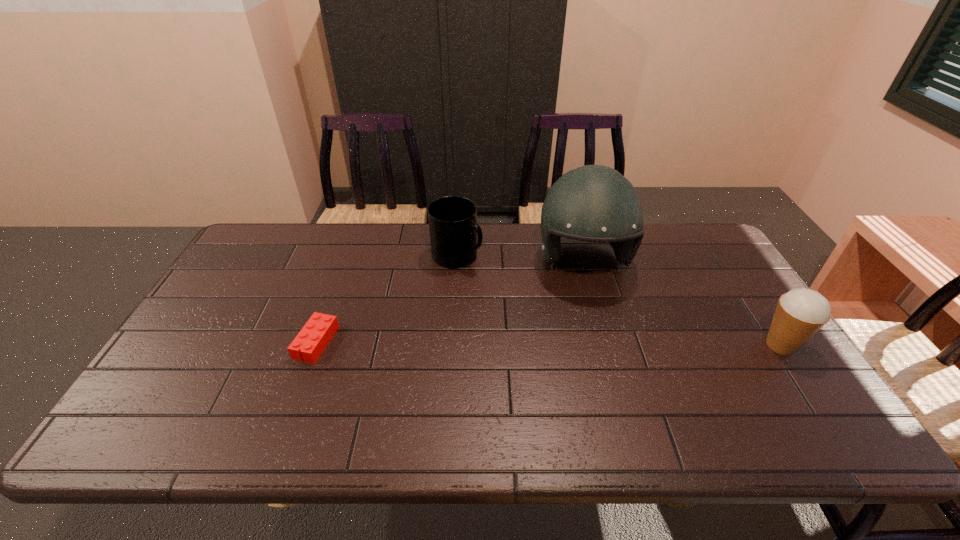
The height and width of the screenshot is (540, 960). Identify the location of free location located 0.300m at the face opening of the second object from right to left. (612, 380).

The width and height of the screenshot is (960, 540). Find the location of `vacant region located 0.380m on the side of the second object from left to right with the handle`. vacant region located 0.380m on the side of the second object from left to right with the handle is located at coordinates (575, 329).

Where is `vacant space located on the side of the second object from left to right with the handle`? The width and height of the screenshot is (960, 540). vacant space located on the side of the second object from left to right with the handle is located at coordinates (565, 323).

Identify the location of free space located on the side of the second object from left to right with the handle. (509, 288).

At what (x,y) coordinates should I click in order to perform the action: click on football helmet that is at the far edge. Please return your answer as a coordinate pair (x, y). Looking at the image, I should click on (594, 203).

I want to click on mug located at the far edge, so click(453, 227).

I want to click on object that is at the right edge, so click(800, 313).

You are a GUI agent. You are given a task and a screenshot of the screen. Output one action in this format:
    pyautogui.click(x=<x>, y=<y>)
    Task: Click on the vacant space at the far edge of the desktop
    Image resolution: width=960 pixels, height=540 pixels.
    Given the screenshot: What is the action you would take?
    pyautogui.click(x=365, y=234)

Locate an element on the screen. The image size is (960, 540). free space at the near edge is located at coordinates (552, 403).

In the image, there is a desktop. In order to click on vacant space at the left edge in this screenshot , I will do `click(237, 335)`.